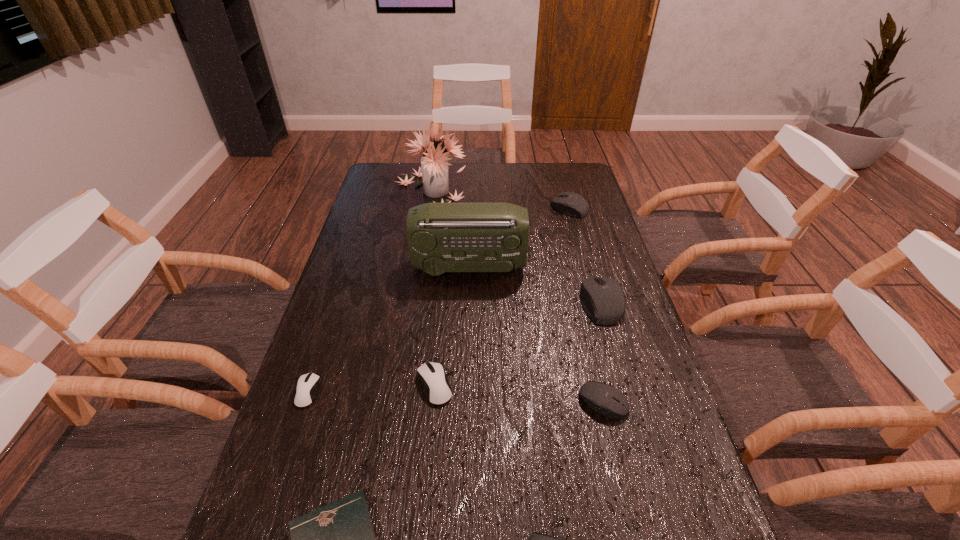
This screenshot has width=960, height=540. In order to click on bouquet located in the left edge section of the desktop in this screenshot , I will do `click(434, 166)`.

Locate an element on the screen. The image size is (960, 540). mouse situated at the left edge is located at coordinates (307, 386).

This screenshot has height=540, width=960. I want to click on object that is at the far left corner, so click(434, 166).

Image resolution: width=960 pixels, height=540 pixels. I want to click on vacant space at the far edge of the desktop, so click(419, 166).

This screenshot has width=960, height=540. In the image, there is a desktop. Identify the location of vacant space at the left edge. (295, 517).

The height and width of the screenshot is (540, 960). I want to click on free region at the right edge of the desktop, so click(574, 246).

Locate an element on the screen. vacant area at the far left corner of the desktop is located at coordinates (393, 189).

The height and width of the screenshot is (540, 960). Find the location of `vacant area that lies between the smaller white mouse and the seventh shortest object`. vacant area that lies between the smaller white mouse and the seventh shortest object is located at coordinates (454, 347).

Identify the location of free space between the smaller white mouse and the second nearest black computer equipment. (455, 396).

You are a GUI agent. You are given a task and a screenshot of the screen. Output one action in this format:
    pyautogui.click(x=<x>, y=<y>)
    Task: Click on the empty space that is in between the seventh shortest object and the second tallest object
    The image size is (960, 540).
    Given the screenshot: What is the action you would take?
    pyautogui.click(x=535, y=285)